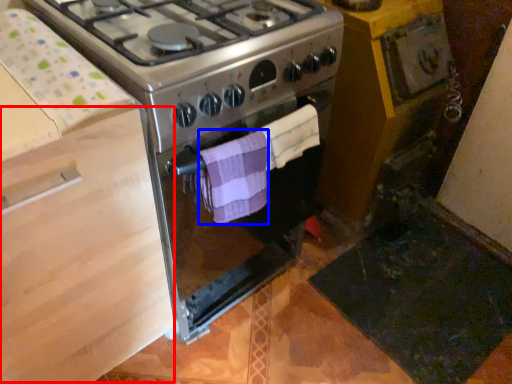
Question: Which object appears closest to the camera in this image, drawer (highlighted by a red box) or towel/napkin (highlighted by a blue box)?

Choices:
 (A) drawer
 (B) towel/napkin

Answer: (A)